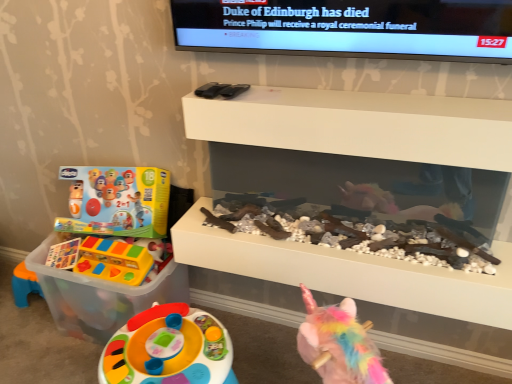
In order to face translucent plastic toy at left, the second toy when ordered from top to bottom, should I rotate leftwards or rightwards?

It's best to rotate left around 18.145 degrees.

What do you see at coordinates (115, 261) in the screenshot? The width and height of the screenshot is (512, 384). I see `matte plastic toy at left, the second toy ordered from the bottom` at bounding box center [115, 261].

Identify the location of white matte shelf at upper center, positioned as the 2th shelf in bottom-to-top order. The width and height of the screenshot is (512, 384). (360, 125).

You are a GUI agent. You are given a task and a screenshot of the screen. Output one action in this format:
    pyautogui.click(x=<x>, y=<y>)
    Task: Click on the translucent plastic toy at left, the second toy when ordered from top to bottom
    
    Given the screenshot: What is the action you would take?
    pyautogui.click(x=116, y=235)

Based on the photo, considering their positions, is white matte fireplace at center, the second shelf from the top, located in front of or behind white matte shelf at upper center, the first shelf from the top?

white matte fireplace at center, the second shelf from the top, is positioned farther from the viewer than white matte shelf at upper center, the first shelf from the top.

Considering the points (499, 291) and (244, 99), which point is in front, point (499, 291) or point (244, 99)?

The point (499, 291) is closer to the camera.

From the picture: From the image's perspective, which one is positioned lower, white matte fireplace at center, marked as the first shelf in a bottom-to-top arrangement, or white matte shelf at upper center, positioned as the 2th shelf in bottom-to-top order?

white matte fireplace at center, marked as the first shelf in a bottom-to-top arrangement, appears lower in the image.

Which object is wider, white matte fireplace at center, marked as the first shelf in a bottom-to-top arrangement, or white matte shelf at upper center, the first shelf from the top?

Wider between the two is white matte fireplace at center, marked as the first shelf in a bottom-to-top arrangement.

Looking at this image, from a real-world perspective, which is physically above, matte plastic toy at left, the first toy when ordered from top to bottom, or white matte fireplace at center, the second shelf from the top?

From a 3D spatial view, white matte fireplace at center, the second shelf from the top, is above.

Starting from the white matte fireplace at center, the second shelf from the top, which toy is the 1st one to the left? Please provide its 2D coordinates.

[(115, 261)]

Can you confirm if matte plastic toy at left, the first toy when ordered from top to bottom, is bigger than white matte fireplace at center, marked as the first shelf in a bottom-to-top arrangement?

No, matte plastic toy at left, the first toy when ordered from top to bottom, is not bigger than white matte fireplace at center, marked as the first shelf in a bottom-to-top arrangement.

Measure the distance between white matte shelf at upper center, the first shelf from the top, and matte plastic toy at left, the second toy ordered from the bottom.

white matte shelf at upper center, the first shelf from the top, is 29.24 inches from matte plastic toy at left, the second toy ordered from the bottom.

From the image's perspective, is white matte shelf at upper center, positioned as the 2th shelf in bottom-to-top order, above or below matte plastic toy at left, the first toy when ordered from top to bottom?

white matte shelf at upper center, positioned as the 2th shelf in bottom-to-top order, is above matte plastic toy at left, the first toy when ordered from top to bottom.

Which is closer to the camera, (244, 110) or (114, 263)?

Point (244, 110) is positioned closer to the camera compared to point (114, 263).

Looking at this image, is white matte shelf at upper center, positioned as the 2th shelf in bottom-to-top order, not inside matte plastic toy at left, the first toy when ordered from top to bottom?

Yes, white matte shelf at upper center, positioned as the 2th shelf in bottom-to-top order, is located beyond the bounds of matte plastic toy at left, the first toy when ordered from top to bottom.

From a real-world perspective, is matte plastic toy at left, the second toy ordered from the bottom, located higher than translucent plastic toy at left, the first toy from the bottom?

Yes, from a real-world perspective, matte plastic toy at left, the second toy ordered from the bottom, is above translucent plastic toy at left, the first toy from the bottom.

Is translucent plastic toy at left, the first toy from the bottom, located within matte plastic toy at left, the second toy ordered from the bottom?

No, translucent plastic toy at left, the first toy from the bottom, is not a part of matte plastic toy at left, the second toy ordered from the bottom.

From the image's perspective, which one is positioned lower, matte plastic toy at left, the second toy ordered from the bottom, or translucent plastic toy at left, the second toy when ordered from top to bottom?

translucent plastic toy at left, the second toy when ordered from top to bottom, from the image's perspective.

From a real-world perspective, between matte plastic toy at left, the second toy ordered from the bottom, and white matte shelf at upper center, the first shelf from the top, who is vertically lower?

matte plastic toy at left, the second toy ordered from the bottom.

Relative to white matte shelf at upper center, positioned as the 2th shelf in bottom-to-top order, is matte plastic toy at left, the first toy when ordered from top to bottom, in front or behind?

matte plastic toy at left, the first toy when ordered from top to bottom, is positioned farther from the viewer than white matte shelf at upper center, positioned as the 2th shelf in bottom-to-top order.

From the image's perspective, which one is positioned higher, matte plastic toy at left, the second toy ordered from the bottom, or white matte shelf at upper center, the first shelf from the top?

From the image's view, white matte shelf at upper center, the first shelf from the top, is above.

Between point (142, 247) and point (191, 138), which one is positioned in front?

The point (191, 138) is more forward.

Can you confirm if translucent plastic toy at left, the first toy from the bottom, is thinner than matte plastic toy at left, the first toy when ordered from top to bottom?

No.

Between point (29, 262) and point (153, 277), which one is positioned behind?

The point (29, 262) is more distant.

From the image's perspective, is translucent plastic toy at left, the second toy when ordered from top to bottom, located above or below matte plastic toy at left, the second toy ordered from the bottom?

Based on their image positions, translucent plastic toy at left, the second toy when ordered from top to bottom, is located beneath matte plastic toy at left, the second toy ordered from the bottom.

Is point (340, 109) less distant than point (92, 287)?

Yes, point (340, 109) is in front of point (92, 287).

From a real-world perspective, which object stands above the other?

In real-world perspective, white matte shelf at upper center, positioned as the 2th shelf in bottom-to-top order, is above.

Could you tell me if white matte shelf at upper center, the first shelf from the top, is turned towards translucent plastic toy at left, the second toy when ordered from top to bottom?

No, white matte shelf at upper center, the first shelf from the top, is not turned towards translucent plastic toy at left, the second toy when ordered from top to bottom.

Considering the relative sizes of white matte shelf at upper center, positioned as the 2th shelf in bottom-to-top order, and translucent plastic toy at left, the second toy when ordered from top to bottom, in the image provided, is white matte shelf at upper center, positioned as the 2th shelf in bottom-to-top order, smaller than translucent plastic toy at left, the second toy when ordered from top to bottom,?

Yes, white matte shelf at upper center, positioned as the 2th shelf in bottom-to-top order, is smaller than translucent plastic toy at left, the second toy when ordered from top to bottom.

The image size is (512, 384). In the image, there is a white matte shelf at upper center, positioned as the 2th shelf in bottom-to-top order. In order to click on shelf below it (from the image's perspective) in this screenshot , I will do `click(360, 124)`.

From a real-world perspective, which toy is the 1st one underneath the white matte fireplace at center, the second shelf from the top? Please provide its 2D coordinates.

[(115, 261)]

From the picture: Looking at the image, which one is located further to matte plastic toy at left, the second toy ordered from the bottom, white matte fireplace at center, marked as the first shelf in a bottom-to-top arrangement, or translucent plastic toy at left, the second toy when ordered from top to bottom?

white matte fireplace at center, marked as the first shelf in a bottom-to-top arrangement, is positioned further to the anchor matte plastic toy at left, the second toy ordered from the bottom.

Which object lies further to the anchor point white matte fireplace at center, the second shelf from the top, matte plastic toy at left, the first toy when ordered from top to bottom, or white matte shelf at upper center, the first shelf from the top?

The object further to white matte fireplace at center, the second shelf from the top, is matte plastic toy at left, the first toy when ordered from top to bottom.

From the image, which object appears to be nearer to white matte fireplace at center, marked as the first shelf in a bottom-to-top arrangement, white matte shelf at upper center, the first shelf from the top, or matte plastic toy at left, the second toy ordered from the bottom?

white matte shelf at upper center, the first shelf from the top, lies closer to white matte fireplace at center, marked as the first shelf in a bottom-to-top arrangement, than the other object.

When comparing their distances from translucent plastic toy at left, the first toy from the bottom, does matte plastic toy at left, the second toy ordered from the bottom, or white matte fireplace at center, the second shelf from the top, seem closer?

Based on the image, matte plastic toy at left, the second toy ordered from the bottom, appears to be nearer to translucent plastic toy at left, the first toy from the bottom.

When comparing their distances from white matte fireplace at center, the second shelf from the top, does white matte shelf at upper center, the first shelf from the top, or translucent plastic toy at left, the second toy when ordered from top to bottom, seem further?

translucent plastic toy at left, the second toy when ordered from top to bottom, is positioned further to the anchor white matte fireplace at center, the second shelf from the top.

Which object lies further to the anchor point white matte fireplace at center, marked as the first shelf in a bottom-to-top arrangement, matte plastic toy at left, the first toy when ordered from top to bottom, or translucent plastic toy at left, the second toy when ordered from top to bottom?

translucent plastic toy at left, the second toy when ordered from top to bottom.

Which object lies further to the anchor point translucent plastic toy at left, the second toy when ordered from top to bottom, white matte shelf at upper center, the first shelf from the top, or matte plastic toy at left, the first toy when ordered from top to bottom?

Based on the image, white matte shelf at upper center, the first shelf from the top, appears to be further to translucent plastic toy at left, the second toy when ordered from top to bottom.

In the scene shown: Based on their spatial positions, is translucent plastic toy at left, the second toy when ordered from top to bottom, or matte plastic toy at left, the second toy ordered from the bottom, further from white matte shelf at upper center, positioned as the 2th shelf in bottom-to-top order?

Answer: Among the two, matte plastic toy at left, the second toy ordered from the bottom, is located further to white matte shelf at upper center, positioned as the 2th shelf in bottom-to-top order.

The image size is (512, 384). I want to click on toy between translucent plastic toy at left, the first toy from the bottom, and white matte shelf at upper center, positioned as the 2th shelf in bottom-to-top order, from left to right, so (x=115, y=261).

At what (x,y) coordinates should I click in order to perform the action: click on toy between translucent plastic toy at left, the first toy from the bottom, and white matte fireplace at center, the second shelf from the top. Please return your answer as a coordinate pair (x, y). The height and width of the screenshot is (384, 512). Looking at the image, I should click on (115, 261).

Find the location of a particular element. The width and height of the screenshot is (512, 384). shelf situated between translucent plastic toy at left, the first toy from the bottom, and white matte fireplace at center, the second shelf from the top, from left to right is located at coordinates (360, 125).

This screenshot has width=512, height=384. Find the location of `shelf located between matte plastic toy at left, the second toy ordered from the bottom, and white matte fireplace at center, marked as the first shelf in a bottom-to-top arrangement, in the left-right direction`. shelf located between matte plastic toy at left, the second toy ordered from the bottom, and white matte fireplace at center, marked as the first shelf in a bottom-to-top arrangement, in the left-right direction is located at coordinates (360, 125).